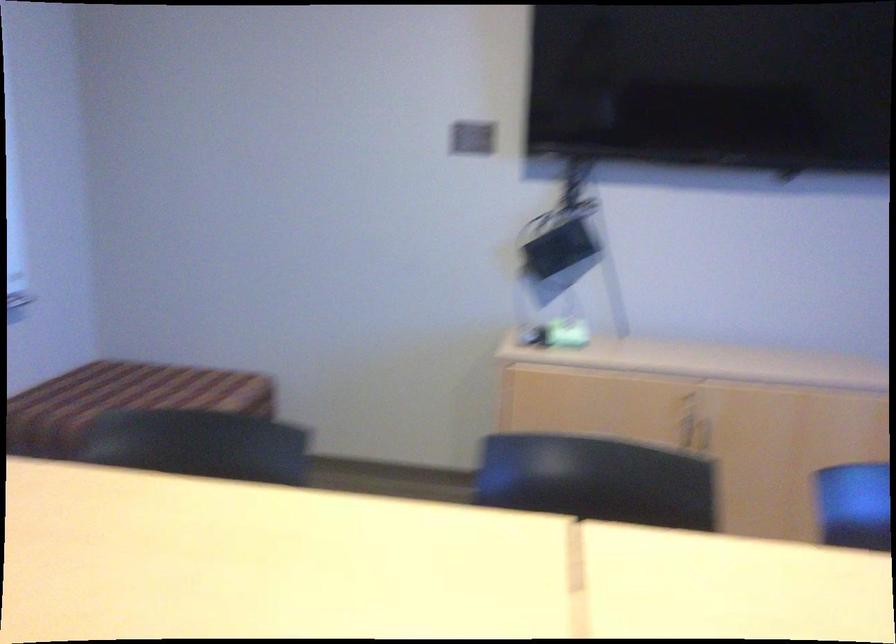
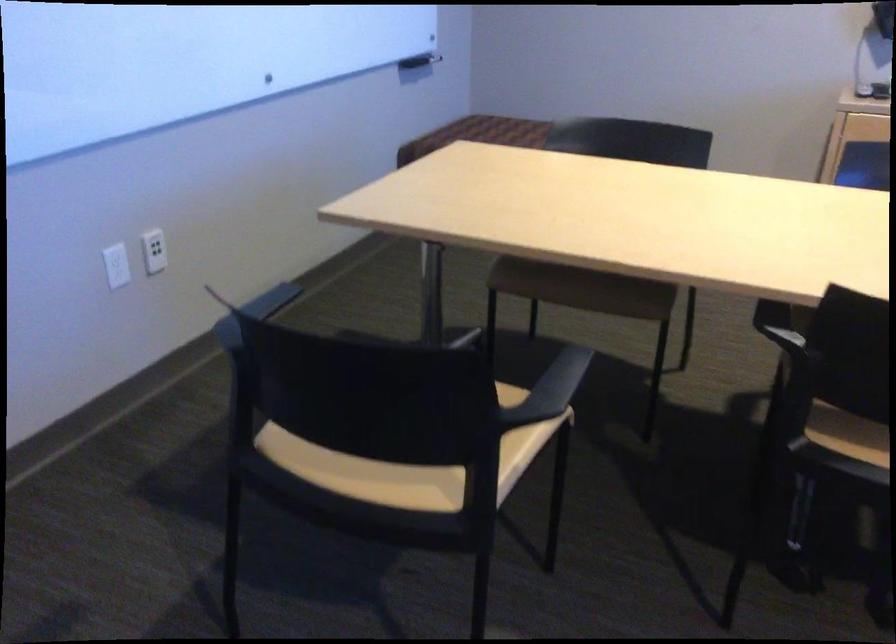
Question: Which direction would the cameraman need to move to produce the second image? Reply with the corresponding letter.

Choices:
 (A) Left
 (B) Right
 (C) Forward
 (D) Backward

Answer: (D)